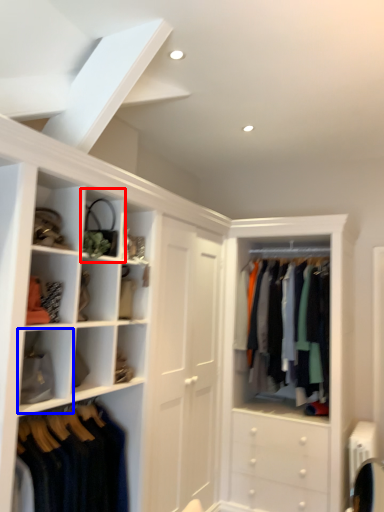
Question: Among these objects, which one is farthest to the camera, cabinet (highlighted by a red box) or cabinet (highlighted by a blue box)?

Choices:
 (A) cabinet
 (B) cabinet

Answer: (A)